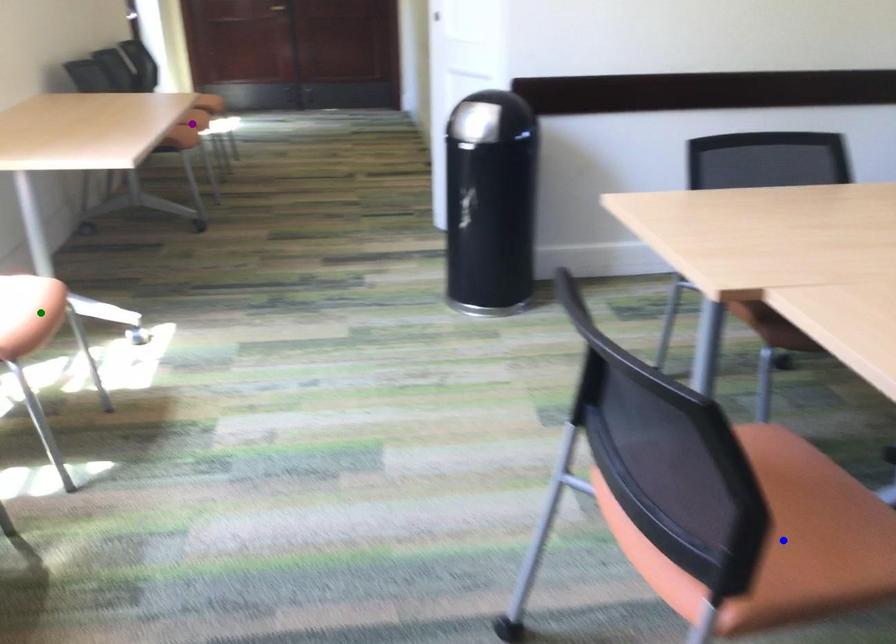
Order these from nearest to farthest:
A) purple point
B) blue point
C) green point

blue point < green point < purple point